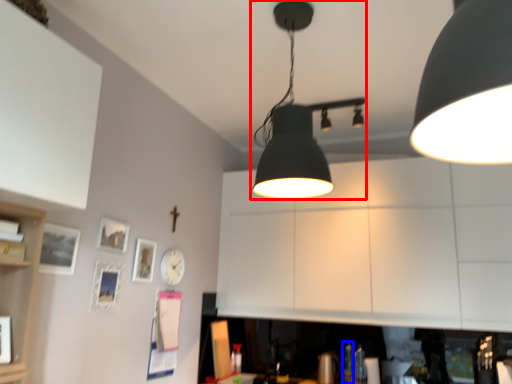
Question: Which of the following is the farthest to the observer, lamp (highlighted by a red box) or bottle (highlighted by a blue box)?

Choices:
 (A) lamp
 (B) bottle

Answer: (B)